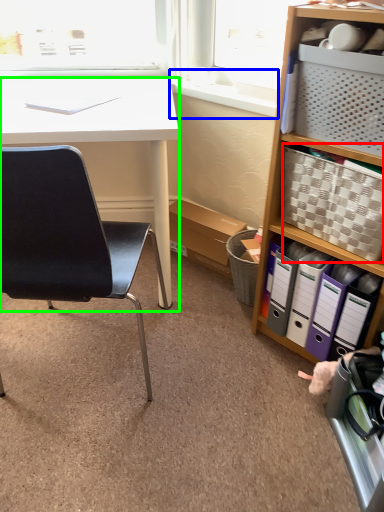
Question: Which object is the closest to the picnic basket (highlighted by a red box)? Choose among these: window sill (highlighted by a blue box) or desk (highlighted by a green box).

Choices:
 (A) window sill
 (B) desk

Answer: (A)